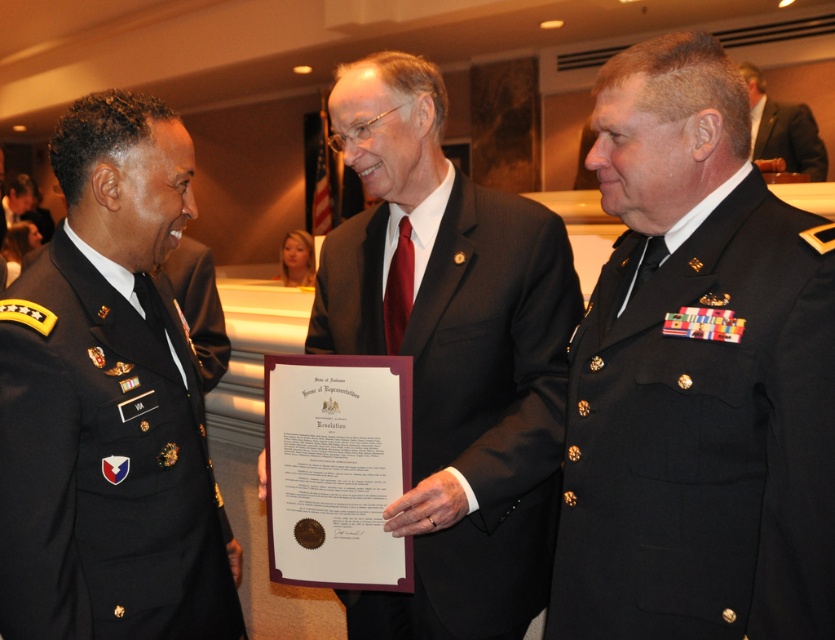
Question: Estimate the real-world distances between objects in this image. Which object is closer to the black matte uniform at center?

Choices:
 (A) black matte suit at center
 (B) dark green wool military uniform at left
 (C) dark suit at center

Answer: (A)

Question: Among these objects, which one is farthest from the camera?

Choices:
 (A) black matte uniform at center
 (B) dark suit at center
 (C) dark green wool military uniform at left

Answer: (B)

Question: Which object appears closest to the camera in this image?

Choices:
 (A) dark green wool military uniform at left
 (B) black matte uniform at center
 (C) dark suit at center
 (D) black matte suit at center

Answer: (B)

Question: Does black matte uniform at center appear under black matte suit at center?

Choices:
 (A) no
 (B) yes

Answer: (A)

Question: Is dark green wool military uniform at left smaller than dark suit at center?

Choices:
 (A) yes
 (B) no

Answer: (A)

Question: Is dark green wool military uniform at left above dark suit at center?

Choices:
 (A) yes
 (B) no

Answer: (B)